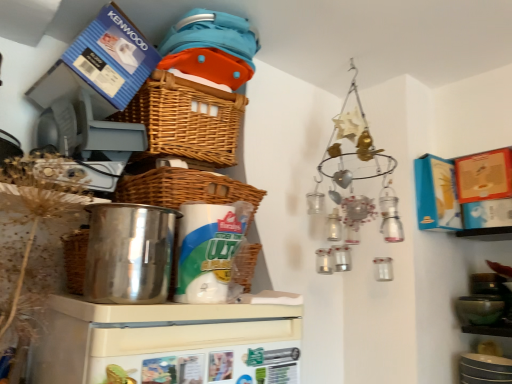
What do you see at coordinates (129, 253) in the screenshot? I see `polished stainless steel pot at left, which is the 2th appliance from bottom to top` at bounding box center [129, 253].

Measure the distance between woven brown basket at center, the 2th basket positioned from the top, and camera.

The distance of woven brown basket at center, the 2th basket positioned from the top, from camera is 1.04 meters.

Where is `white plastic refrigerator at center, which ranks as the first appliance in bottom-to-top order`? The image size is (512, 384). white plastic refrigerator at center, which ranks as the first appliance in bottom-to-top order is located at coordinates (168, 343).

Image resolution: width=512 pixels, height=384 pixels. What are the coordinates of `polished stainless steel pot at left, which is the 2th appliance from bottom to top` in the screenshot? It's located at (129, 253).

Considering the positions of objects polished stainless steel pot at left, which is the 2th appliance from bottom to top, and woven brown basket at center, which is the first basket from bottom to top, in the image provided, who is more to the left, polished stainless steel pot at left, which is the 2th appliance from bottom to top, or woven brown basket at center, which is the first basket from bottom to top,?

Positioned to the left is polished stainless steel pot at left, which is the 2th appliance from bottom to top.

Is polished stainless steel pot at left, which is the 2th appliance from bottom to top, thinner than woven brown basket at center, the 2th basket positioned from the top?

Indeed, polished stainless steel pot at left, which is the 2th appliance from bottom to top, has a lesser width compared to woven brown basket at center, the 2th basket positioned from the top.

From the picture: Could you tell me if polished stainless steel pot at left, which is the 2th appliance from bottom to top, is turned towards woven brown basket at center, which is the first basket from bottom to top?

No, polished stainless steel pot at left, which is the 2th appliance from bottom to top, does not turn towards woven brown basket at center, which is the first basket from bottom to top.

Which object is closer to the camera, polished stainless steel pot at left, the first appliance from the top, or woven brown basket at center, which is the first basket from bottom to top?

polished stainless steel pot at left, the first appliance from the top, is more forward.

From the image's perspective, which appliance is the 1st one below the woven brown basket at upper center, positioned as the second basket in bottom-to-top order? Please provide its 2D coordinates.

[(129, 253)]

Considering the sizes of objects polished stainless steel pot at left, the first appliance from the top, and woven brown basket at upper center, positioned as the second basket in bottom-to-top order, in the image provided, who is smaller, polished stainless steel pot at left, the first appliance from the top, or woven brown basket at upper center, positioned as the second basket in bottom-to-top order,?

Smaller between the two is polished stainless steel pot at left, the first appliance from the top.

From the image's perspective, which is below, polished stainless steel pot at left, the first appliance from the top, or woven brown basket at upper center, which ranks as the 1th basket in top-to-bottom order?

polished stainless steel pot at left, the first appliance from the top, from the image's perspective.

Looking at their sizes, would you say polished stainless steel pot at left, which is the 2th appliance from bottom to top, is wider or thinner than woven brown basket at upper center, positioned as the second basket in bottom-to-top order?

polished stainless steel pot at left, which is the 2th appliance from bottom to top, is thinner than woven brown basket at upper center, positioned as the second basket in bottom-to-top order.

Find the location of a particular element. appliance that is the 1st object located below the woven brown basket at upper center, positioned as the second basket in bottom-to-top order (from the image's perspective) is located at coordinates (129, 253).

From the image's perspective, is woven brown basket at upper center, positioned as the second basket in bottom-to-top order, on top of polished stainless steel pot at left, which is the 2th appliance from bottom to top?

Yes, from the image's perspective, woven brown basket at upper center, positioned as the second basket in bottom-to-top order, is over polished stainless steel pot at left, which is the 2th appliance from bottom to top.

Considering the sizes of objects woven brown basket at upper center, positioned as the second basket in bottom-to-top order, and polished stainless steel pot at left, the first appliance from the top, in the image provided, who is shorter, woven brown basket at upper center, positioned as the second basket in bottom-to-top order, or polished stainless steel pot at left, the first appliance from the top,?

With less height is polished stainless steel pot at left, the first appliance from the top.

From the image's perspective, is white plastic refrigerator at center, which ranks as the first appliance in bottom-to-top order, positioned above or below polished stainless steel pot at left, the first appliance from the top?

From the image's perspective, white plastic refrigerator at center, which ranks as the first appliance in bottom-to-top order, appears below polished stainless steel pot at left, the first appliance from the top.

Where is `appliance located above the white plastic refrigerator at center, which ranks as the first appliance in bottom-to-top order (from the image's perspective)`? Image resolution: width=512 pixels, height=384 pixels. appliance located above the white plastic refrigerator at center, which ranks as the first appliance in bottom-to-top order (from the image's perspective) is located at coordinates (129, 253).

Does point (121, 364) appear closer or farther from the camera than point (129, 224)?

Point (121, 364).

Who is more distant, white plastic refrigerator at center, which is the second appliance in top-to-bottom order, or polished stainless steel pot at left, which is the 2th appliance from bottom to top?

Positioned behind is polished stainless steel pot at left, which is the 2th appliance from bottom to top.

Identify the location of appliance that is the 2nd object located below the woven brown basket at center, which is the first basket from bottom to top (from the image's perspective). [x=168, y=343].

In the scene shown: How many degrees apart are the facing directions of woven brown basket at center, which is the first basket from bottom to top, and white plastic refrigerator at center, which is the second appliance in top-to-bottom order?

0.652 degrees.

Considering the points (206, 183) and (82, 369), which point is behind, point (206, 183) or point (82, 369)?

The point (206, 183) is more distant.

Relative to white plastic refrigerator at center, which ranks as the first appliance in bottom-to-top order, is woven brown basket at center, the 2th basket positioned from the top, in front or behind?

In the image, woven brown basket at center, the 2th basket positioned from the top, appears behind white plastic refrigerator at center, which ranks as the first appliance in bottom-to-top order.

Is white plastic refrigerator at center, which ranks as the first appliance in bottom-to-top order, behind woven brown basket at upper center, positioned as the second basket in bottom-to-top order?

No, white plastic refrigerator at center, which ranks as the first appliance in bottom-to-top order, is closer to the camera.

Is white plastic refrigerator at center, which ranks as the first appliance in bottom-to-top order, not within woven brown basket at upper center, which ranks as the 1th basket in top-to-bottom order?

Indeed, white plastic refrigerator at center, which ranks as the first appliance in bottom-to-top order, is completely outside woven brown basket at upper center, which ranks as the 1th basket in top-to-bottom order.

Is point (50, 349) closer to camera compared to point (206, 95)?

Yes, it is in front of point (206, 95).

Which of these two, white plastic refrigerator at center, which ranks as the first appliance in bottom-to-top order, or woven brown basket at upper center, positioned as the second basket in bottom-to-top order, is smaller?

woven brown basket at upper center, positioned as the second basket in bottom-to-top order, is smaller.

Considering the positions of point (140, 186) and point (178, 145), is point (140, 186) closer or farther from the camera than point (178, 145)?

Point (140, 186) is positioned closer to the camera compared to point (178, 145).

Is woven brown basket at center, which is the first basket from bottom to top, located outside woven brown basket at upper center, which ranks as the 1th basket in top-to-bottom order?

Absolutely, woven brown basket at center, which is the first basket from bottom to top, is external to woven brown basket at upper center, which ranks as the 1th basket in top-to-bottom order.

Does woven brown basket at center, which is the first basket from bottom to top, appear on the right side of woven brown basket at upper center, positioned as the second basket in bottom-to-top order?

Indeed, woven brown basket at center, which is the first basket from bottom to top, is positioned on the right side of woven brown basket at upper center, positioned as the second basket in bottom-to-top order.

Which object is more forward, woven brown basket at center, the 2th basket positioned from the top, or woven brown basket at upper center, which ranks as the 1th basket in top-to-bottom order?

woven brown basket at center, the 2th basket positioned from the top, is closer to the camera.

From a real-world perspective, count 1st baskets upward from the polished stainless steel pot at left, the first appliance from the top, and point to it. Please provide its 2D coordinates.

[(184, 188)]

Which basket is the 2nd one when counting from the back of the polished stainless steel pot at left, which is the 2th appliance from bottom to top? Please provide its 2D coordinates.

[(186, 119)]

Looking at the image, which one is located closer to polished stainless steel pot at left, the first appliance from the top, white plastic refrigerator at center, which ranks as the first appliance in bottom-to-top order, or woven brown basket at center, which is the first basket from bottom to top?

white plastic refrigerator at center, which ranks as the first appliance in bottom-to-top order, is positioned closer to the anchor polished stainless steel pot at left, the first appliance from the top.

Based on their spatial positions, is polished stainless steel pot at left, which is the 2th appliance from bottom to top, or woven brown basket at upper center, positioned as the second basket in bottom-to-top order, further from white plastic refrigerator at center, which is the second appliance in top-to-bottom order?

woven brown basket at upper center, positioned as the second basket in bottom-to-top order, is further to white plastic refrigerator at center, which is the second appliance in top-to-bottom order.

Estimate the real-world distances between objects in this image. Which object is closer to white plastic refrigerator at center, which ranks as the first appliance in bottom-to-top order, woven brown basket at center, which is the first basket from bottom to top, or woven brown basket at upper center, which ranks as the 1th basket in top-to-bottom order?

woven brown basket at center, which is the first basket from bottom to top.

Estimate the real-world distances between objects in this image. Which object is closer to woven brown basket at upper center, which ranks as the 1th basket in top-to-bottom order, white plastic refrigerator at center, which is the second appliance in top-to-bottom order, or polished stainless steel pot at left, the first appliance from the top?

The object closer to woven brown basket at upper center, which ranks as the 1th basket in top-to-bottom order, is polished stainless steel pot at left, the first appliance from the top.

Considering their positions, is polished stainless steel pot at left, which is the 2th appliance from bottom to top, positioned closer to white plastic refrigerator at center, which is the second appliance in top-to-bottom order, than woven brown basket at center, the 2th basket positioned from the top?

polished stainless steel pot at left, which is the 2th appliance from bottom to top.

Considering their positions, is woven brown basket at center, the 2th basket positioned from the top, positioned further to polished stainless steel pot at left, the first appliance from the top, than woven brown basket at upper center, which ranks as the 1th basket in top-to-bottom order?

woven brown basket at upper center, which ranks as the 1th basket in top-to-bottom order.

Based on their spatial positions, is white plastic refrigerator at center, which is the second appliance in top-to-bottom order, or polished stainless steel pot at left, the first appliance from the top, closer to woven brown basket at center, which is the first basket from bottom to top?

polished stainless steel pot at left, the first appliance from the top, is closer to woven brown basket at center, which is the first basket from bottom to top.

From the image, which object appears to be nearer to polished stainless steel pot at left, which is the 2th appliance from bottom to top, woven brown basket at upper center, which ranks as the 1th basket in top-to-bottom order, or woven brown basket at center, the 2th basket positioned from the top?

woven brown basket at center, the 2th basket positioned from the top, is positioned closer to the anchor polished stainless steel pot at left, which is the 2th appliance from bottom to top.

Where is `basket between woven brown basket at upper center, positioned as the second basket in bottom-to-top order, and polished stainless steel pot at left, the first appliance from the top, from top to bottom`? basket between woven brown basket at upper center, positioned as the second basket in bottom-to-top order, and polished stainless steel pot at left, the first appliance from the top, from top to bottom is located at coordinates (184, 188).

This screenshot has height=384, width=512. Find the location of `basket between woven brown basket at upper center, positioned as the second basket in bottom-to-top order, and white plastic refrigerator at center, which is the second appliance in top-to-bottom order, vertically`. basket between woven brown basket at upper center, positioned as the second basket in bottom-to-top order, and white plastic refrigerator at center, which is the second appliance in top-to-bottom order, vertically is located at coordinates (184, 188).

Where is `appliance that lies between woven brown basket at upper center, which ranks as the 1th basket in top-to-bottom order, and white plastic refrigerator at center, which ranks as the first appliance in bottom-to-top order, from top to bottom`? appliance that lies between woven brown basket at upper center, which ranks as the 1th basket in top-to-bottom order, and white plastic refrigerator at center, which ranks as the first appliance in bottom-to-top order, from top to bottom is located at coordinates (129, 253).

Find the location of `appliance between woven brown basket at center, which is the first basket from bottom to top, and white plastic refrigerator at center, which ranks as the first appliance in bottom-to-top order, in the up-down direction`. appliance between woven brown basket at center, which is the first basket from bottom to top, and white plastic refrigerator at center, which ranks as the first appliance in bottom-to-top order, in the up-down direction is located at coordinates (129, 253).